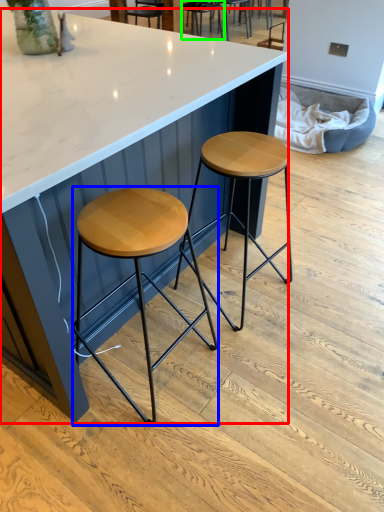
Question: Estimate the real-world distances between objects in this image. Which object is farther from table (highlighted by a red box), stool (highlighted by a blue box) or chair (highlighted by a green box)?

Choices:
 (A) stool
 (B) chair

Answer: (B)